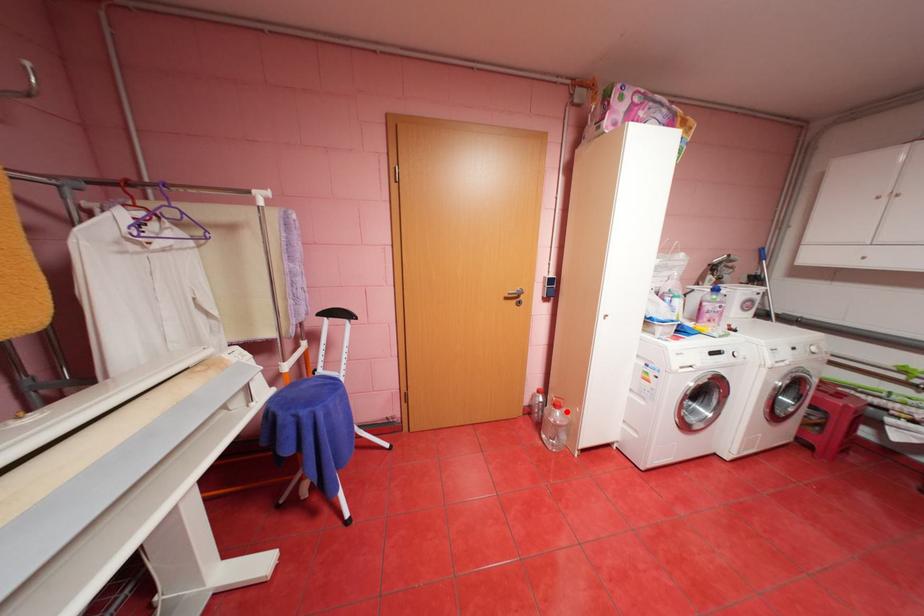
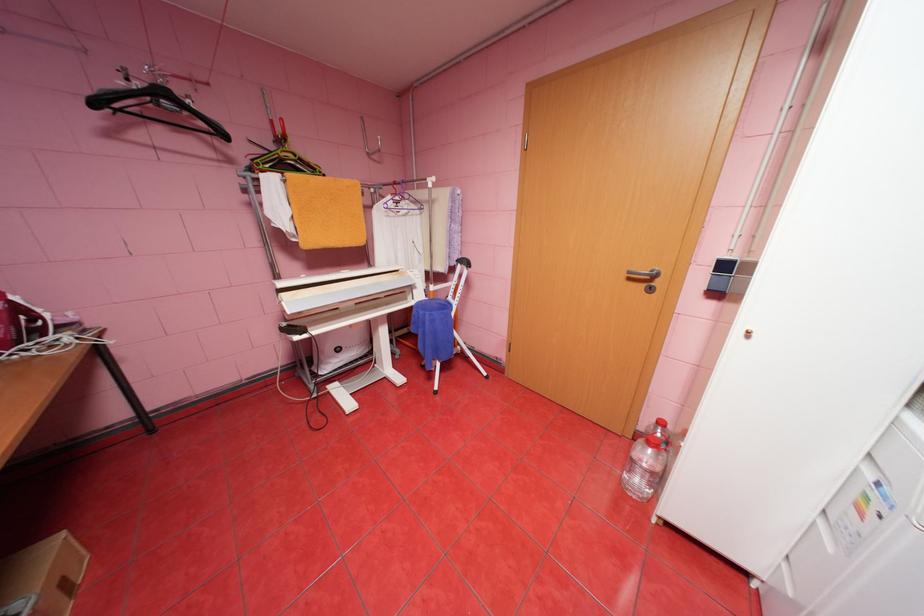
The point at the highlighted location is marked in the first image. Where is the corresponding point in the second image?

(659, 451)